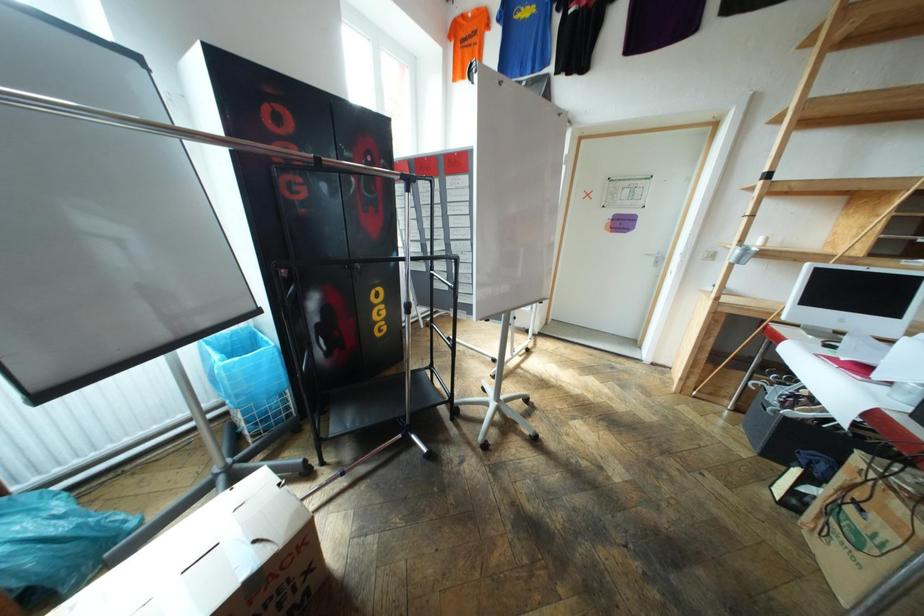
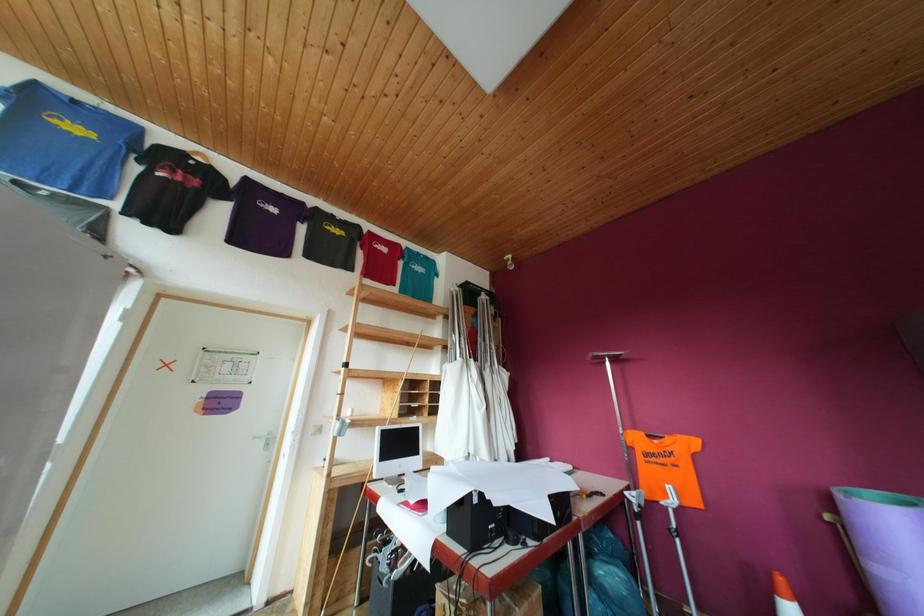
First-person continuous shooting, in which direction is the camera rotating?

The rotation direction of the camera is right-up.